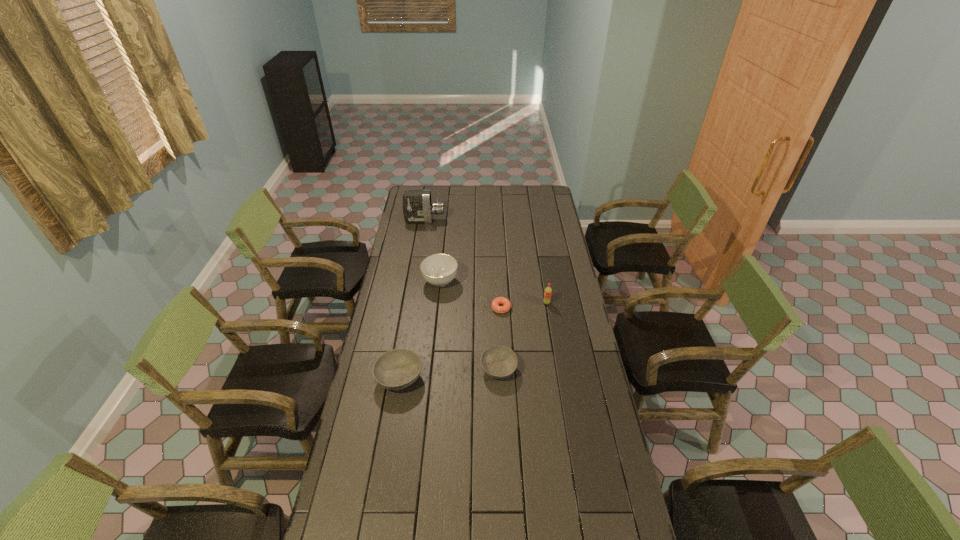
Where is `the taller bowl`? the taller bowl is located at coordinates (396, 369).

At what (x,y) coordinates should I click in order to perform the action: click on the fourth tallest object. Please return your answer as a coordinate pair (x, y). Looking at the image, I should click on (396, 369).

Locate an element on the screen. Image resolution: width=960 pixels, height=540 pixels. the fifth tallest object is located at coordinates (499, 362).

Find the location of a particular element. The width and height of the screenshot is (960, 540). the shorter bowl is located at coordinates (499, 362).

I want to click on chinaware, so click(x=439, y=270).

The height and width of the screenshot is (540, 960). Find the location of `the second farthest object`. the second farthest object is located at coordinates (439, 270).

Identify the location of the tallest object. (417, 207).

Find the location of a particular element. This screenshot has height=540, width=960. camcorder is located at coordinates (417, 207).

Image resolution: width=960 pixels, height=540 pixels. I want to click on the shortest object, so click(x=496, y=302).

Find the location of a particular element. The image size is (960, 540). the rightmost object is located at coordinates (548, 291).